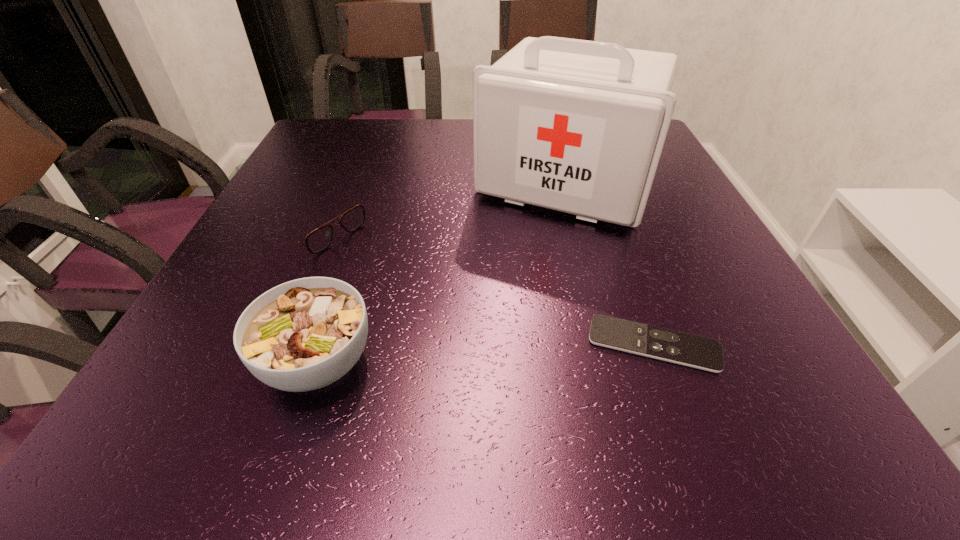
Where is `empty space that is in between the tallest object and the shortest object`? The width and height of the screenshot is (960, 540). empty space that is in between the tallest object and the shortest object is located at coordinates (610, 264).

Locate an element on the screen. The image size is (960, 540). vacant region between the tallest object and the remote control is located at coordinates (610, 264).

The width and height of the screenshot is (960, 540). I want to click on vacant region between the remote control and the third shortest object, so click(x=486, y=353).

The height and width of the screenshot is (540, 960). I want to click on empty space that is in between the sunglasses and the tallest object, so click(439, 204).

This screenshot has height=540, width=960. What are the coordinates of `vacant space in between the first-aid kit and the sunglasses` in the screenshot? It's located at (439, 204).

Select which object is the second closest to the first-aid kit. Please provide its 2D coordinates. Your answer should be formatted as a tuple, i.e. [(x, y)], where the tuple contains the x and y coordinates of a point satisfying the conditions above.

[(704, 353)]

You are a GUI agent. You are given a task and a screenshot of the screen. Output one action in this format:
    pyautogui.click(x=<x>, y=<y>)
    Task: Click on the closest object to the third tallest object
    The image size is (960, 540).
    Given the screenshot: What is the action you would take?
    pyautogui.click(x=302, y=335)

Locate an element on the screen. Image resolution: width=960 pixels, height=540 pixels. vacant space that satisfies the following two spatial constraints: 1. on the front side of the sunglasses; 2. on the left side of the remote control is located at coordinates point(257,345).

Identify the location of vacant area in the image that satisfies the following two spatial constraints: 1. on the front side of the first-aid kit; 2. on the right side of the shortest object. This screenshot has height=540, width=960. (608, 345).

Locate an element on the screen. Image resolution: width=960 pixels, height=540 pixels. vacant area that satisfies the following two spatial constraints: 1. on the front side of the shortest object; 2. on the left side of the tallest object is located at coordinates (608, 345).